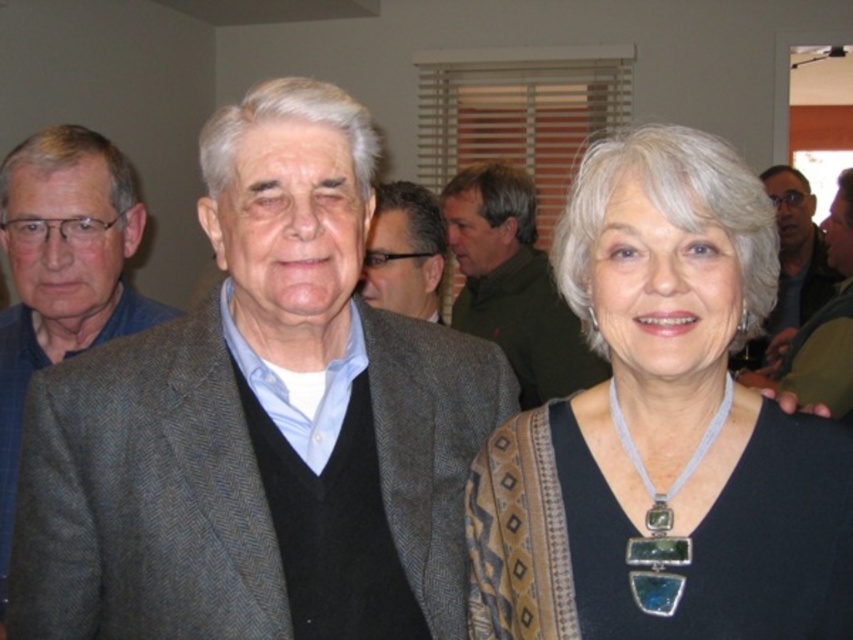
Looking at this image, does gray woolen suit at center have a lesser width compared to gray wool jacket at left?

→ Incorrect, gray woolen suit at center's width is not less than gray wool jacket at left's.

Who is positioned more to the left, gray woolen suit at center or gray wool jacket at left?

gray wool jacket at left is more to the left.

This screenshot has width=853, height=640. Describe the element at coordinates (260, 424) in the screenshot. I see `gray woolen suit at center` at that location.

Where is `gray woolen suit at center`? The height and width of the screenshot is (640, 853). gray woolen suit at center is located at coordinates (260, 424).

Can you confirm if black fabric at center is thinner than green wool sweater at center?

Yes, black fabric at center is thinner than green wool sweater at center.

Can you confirm if black fabric at center is taller than green wool sweater at center?

No.

Is point (727, 404) closer to camera compared to point (563, 332)?

Yes, point (727, 404) is in front of point (563, 332).

Image resolution: width=853 pixels, height=640 pixels. What are the coordinates of `black fabric at center` in the screenshot? It's located at (663, 429).

Between gray woolen suit at center and green wool sweater at center, which one has less height?

Standing shorter between the two is gray woolen suit at center.

Is gray woolen suit at center behind green wool sweater at center?

No, it is in front of green wool sweater at center.

Between point (244, 420) and point (531, 211), which one is positioned in front?

Point (244, 420) is more forward.

Locate an element on the screen. gray woolen suit at center is located at coordinates (260, 424).